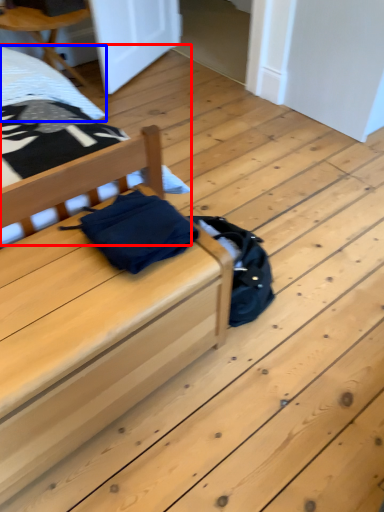
Question: Among these objects, which one is nearest to the camera, bed (highlighted by a red box) or sheet (highlighted by a blue box)?

Choices:
 (A) bed
 (B) sheet

Answer: (A)